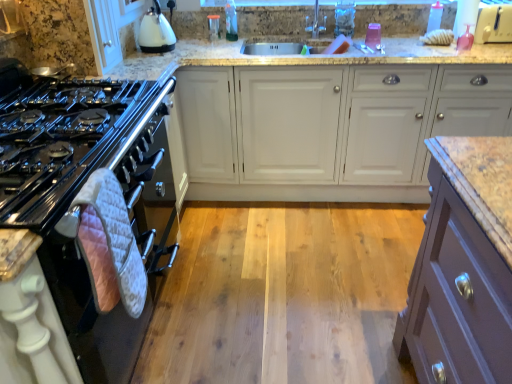
Question: Are translucent plastic bottle at upper center, which appears as the 2th bottle when viewed from the right, and transparent plastic bottle at upper right, the first bottle positioned from the right, making contact?

Choices:
 (A) yes
 (B) no

Answer: (B)

Question: From the image's perspective, is translucent plastic bottle at upper center, which appears as the 2th bottle when viewed from the right, above transparent plastic bottle at upper right, the first bottle positioned from the right?

Choices:
 (A) no
 (B) yes

Answer: (B)

Question: Does translucent plastic bottle at upper center, which appears as the 2th bottle when viewed from the right, lie behind transparent plastic bottle at upper right, the first bottle positioned from the right?

Choices:
 (A) no
 (B) yes

Answer: (B)

Question: Is translucent plastic bottle at upper center, which appears as the 2th bottle when viewed from the right, taller than transparent plastic bottle at upper right, the first bottle positioned from the right?

Choices:
 (A) yes
 (B) no

Answer: (A)

Question: Is transparent plastic bottle at upper right, the first bottle positioned from the right, a part of translucent plastic bottle at upper center, marked as the first bottle in a left-to-right arrangement?

Choices:
 (A) no
 (B) yes

Answer: (A)

Question: Is point (320, 155) closer or farther from the camera than point (131, 130)?

Choices:
 (A) closer
 (B) farther

Answer: (B)

Question: From a real-world perspective, is white matte cabinet at center positioned above or below white quilted oven mitt at left?

Choices:
 (A) above
 (B) below

Answer: (A)

Question: Is white matte cabinet at center situated inside white quilted oven mitt at left or outside?

Choices:
 (A) inside
 (B) outside

Answer: (B)

Question: Is white matte cabinet at center taller or shorter than white quilted oven mitt at left?

Choices:
 (A) short
 (B) tall

Answer: (B)

Question: Considering their positions, is white matte cabinet at center located in front of or behind transparent plastic bottle at upper right, the second bottle in the left-to-right sequence?

Choices:
 (A) behind
 (B) front

Answer: (B)

Question: Is white matte cabinet at center taller or shorter than transparent plastic bottle at upper right, the second bottle in the left-to-right sequence?

Choices:
 (A) short
 (B) tall

Answer: (B)

Question: Would you say white matte cabinet at center is inside or outside transparent plastic bottle at upper right, the second bottle in the left-to-right sequence?

Choices:
 (A) outside
 (B) inside

Answer: (A)

Question: Considering the relative positions of white matte cabinet at center and transparent plastic bottle at upper right, the first bottle positioned from the right, in the image provided, is white matte cabinet at center to the left or to the right of transparent plastic bottle at upper right, the first bottle positioned from the right,?

Choices:
 (A) right
 (B) left

Answer: (B)

Question: Based on their positions, is white quilted oven mitt at left located to the left or right of white glossy kettle at upper left?

Choices:
 (A) left
 (B) right

Answer: (A)

Question: Is white quilted oven mitt at left in front of or behind white glossy kettle at upper left in the image?

Choices:
 (A) behind
 (B) front

Answer: (B)